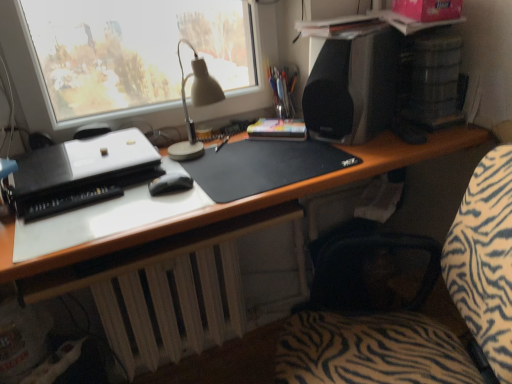
Question: Is zebra-patterned fabric at center bigger than metallic silver pen holder at upper center?

Choices:
 (A) no
 (B) yes

Answer: (B)

Question: Is zebra-patterned fabric at center wider than metallic silver pen holder at upper center?

Choices:
 (A) yes
 (B) no

Answer: (A)

Question: Does zebra-patterned fabric at center contain metallic silver pen holder at upper center?

Choices:
 (A) yes
 (B) no

Answer: (B)

Question: Is zebra-patterned fabric at center next to metallic silver pen holder at upper center and touching it?

Choices:
 (A) no
 (B) yes

Answer: (A)

Question: Are zebra-patterned fabric at center and metallic silver pen holder at upper center far apart?

Choices:
 (A) yes
 (B) no

Answer: (B)

Question: Is point pos(283,84) closer or farther from the camera than point pos(254,167)?

Choices:
 (A) farther
 (B) closer

Answer: (A)

Question: Considering their positions, is metallic silver pen holder at upper center located in front of or behind black matte mousepad at center?

Choices:
 (A) front
 (B) behind

Answer: (B)

Question: Is metallic silver pen holder at upper center spatially inside black matte mousepad at center, or outside of it?

Choices:
 (A) outside
 (B) inside

Answer: (A)

Question: From their relative heights in the image, would you say metallic silver pen holder at upper center is taller or shorter than black matte mousepad at center?

Choices:
 (A) short
 (B) tall

Answer: (B)

Question: Considering the positions of black matte speaker at upper right and black matte mouse at center in the image, is black matte speaker at upper right wider or thinner than black matte mouse at center?

Choices:
 (A) wide
 (B) thin

Answer: (A)

Question: From their relative heights in the image, would you say black matte speaker at upper right is taller or shorter than black matte mouse at center?

Choices:
 (A) tall
 (B) short

Answer: (A)

Question: From the image's perspective, relative to black matte mouse at center, is black matte speaker at upper right above or below?

Choices:
 (A) above
 (B) below

Answer: (A)

Question: Is point (339, 64) positioned closer to the camera than point (177, 188)?

Choices:
 (A) closer
 (B) farther

Answer: (B)

Question: Looking at the image, does metallic silver pen holder at upper center seem bigger or smaller compared to black matte speaker at upper right?

Choices:
 (A) big
 (B) small

Answer: (B)

Question: Considering the positions of metallic silver pen holder at upper center and black matte speaker at upper right in the image, is metallic silver pen holder at upper center taller or shorter than black matte speaker at upper right?

Choices:
 (A) tall
 (B) short

Answer: (B)